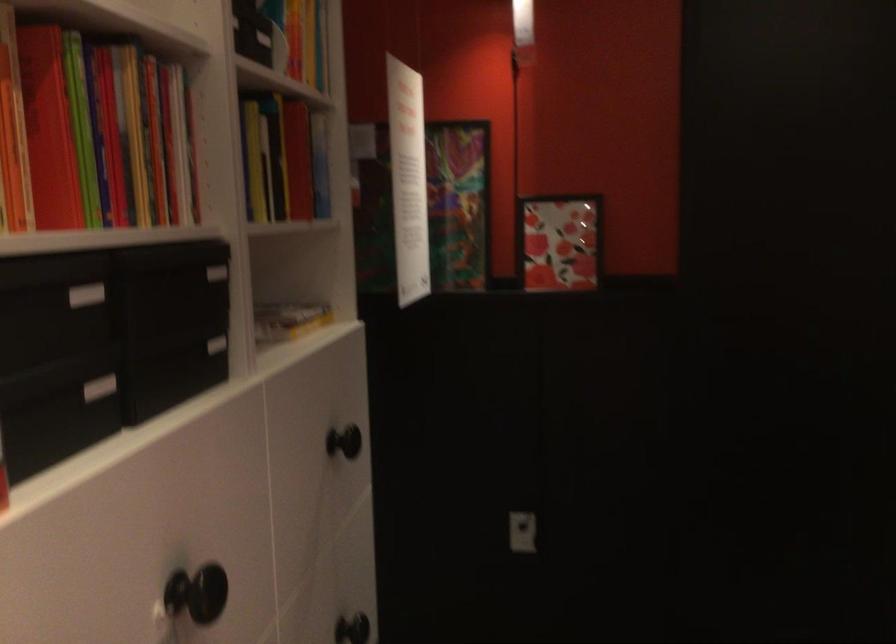
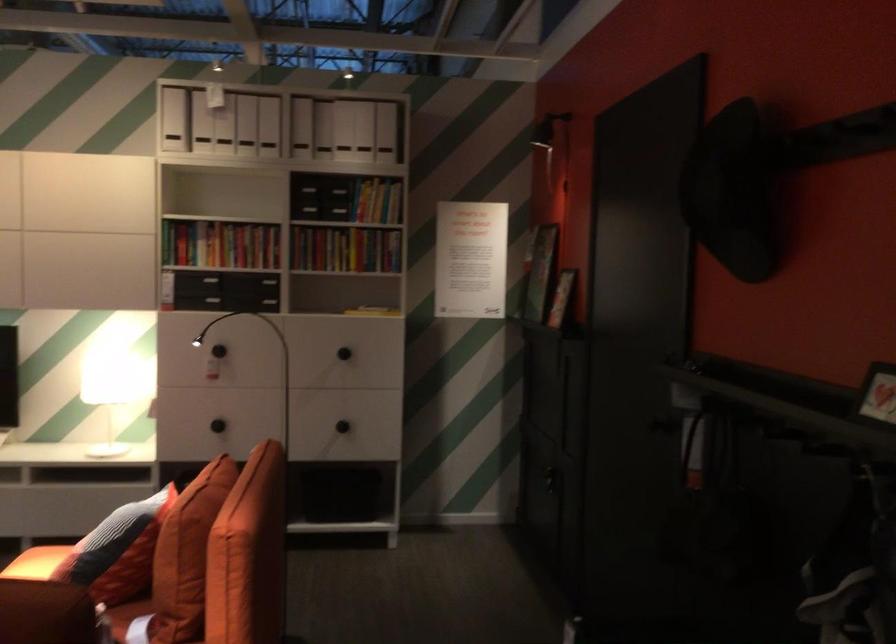
In the second image, find the point that corresponds to (306,69) in the first image.

(376, 201)